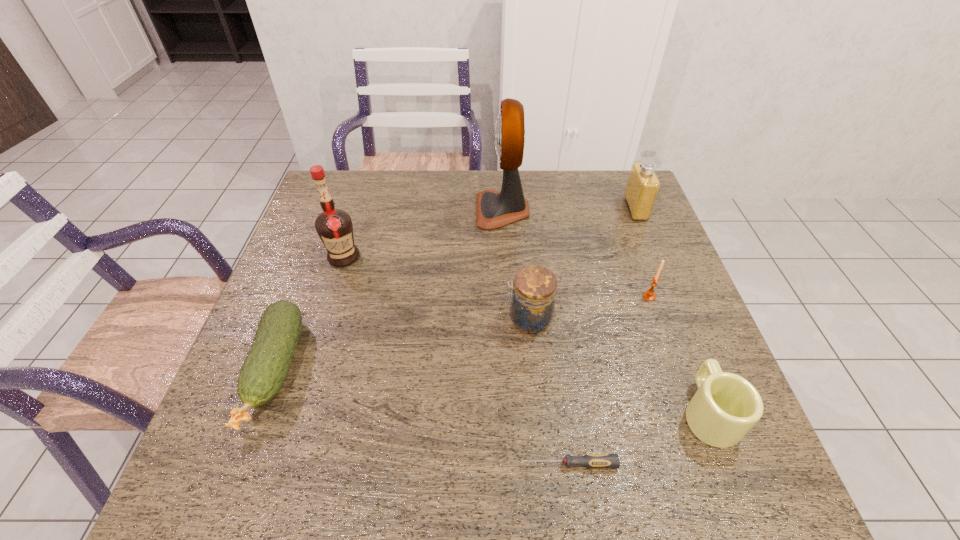
Locate an element on the screen. vacant space that satisfies the following two spatial constraints: 1. on the front side of the fourth farthest object; 2. on the lid of the jar is located at coordinates (658, 319).

Where is `vacant position in the image that satisfies the following two spatial constraints: 1. on the front-facing side of the fan; 2. at the blossom end of the seventh tallest object`? The height and width of the screenshot is (540, 960). vacant position in the image that satisfies the following two spatial constraints: 1. on the front-facing side of the fan; 2. at the blossom end of the seventh tallest object is located at coordinates (512, 370).